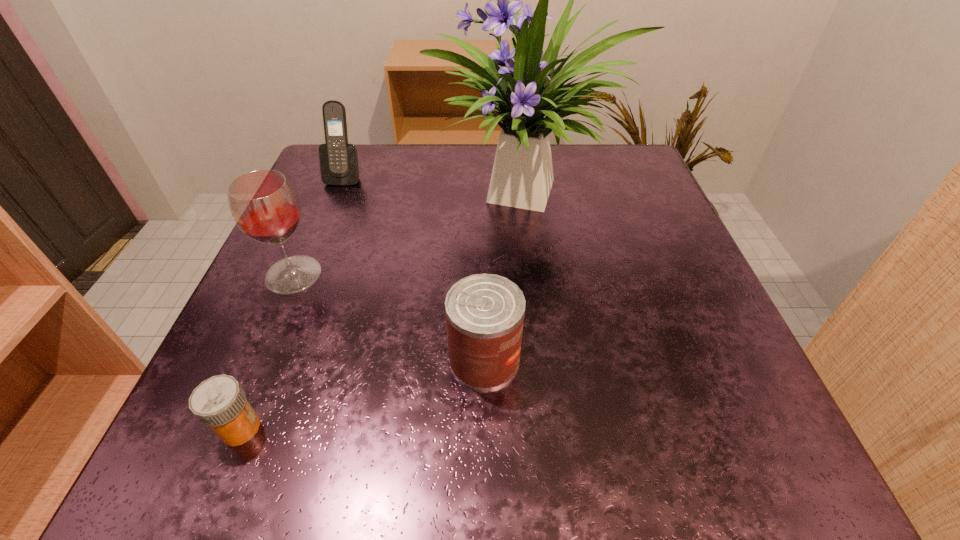
Image resolution: width=960 pixels, height=540 pixels. I want to click on vacant space located on the left of the fourth tallest object, so click(346, 360).

I want to click on vacant space located on the label side of the medicine, so click(394, 428).

Locate an element on the screen. The width and height of the screenshot is (960, 540). flower arrangement at the far edge is located at coordinates [525, 88].

At what (x,y) coordinates should I click in order to perform the action: click on cellular telephone at the far edge. Please return your answer as a coordinate pair (x, y). The height and width of the screenshot is (540, 960). Looking at the image, I should click on (339, 166).

Find the location of a particular element. The image size is (960, 540). object that is at the near edge is located at coordinates (219, 402).

The height and width of the screenshot is (540, 960). What are the coordinates of `wineglass that is at the left edge` in the screenshot? It's located at (265, 207).

This screenshot has height=540, width=960. What are the coordinates of `cellular telephone that is at the left edge` in the screenshot? It's located at (339, 166).

You are a GUI agent. You are given a task and a screenshot of the screen. Output one action in this format:
    pyautogui.click(x=<x>, y=<y>)
    Task: Click on the medicine that is at the left edge
    The width and height of the screenshot is (960, 540).
    Given the screenshot: What is the action you would take?
    pyautogui.click(x=219, y=402)

The image size is (960, 540). I want to click on object that is at the right edge, so click(x=525, y=88).

Where is `object situated at the far left corner`? This screenshot has width=960, height=540. object situated at the far left corner is located at coordinates (339, 166).